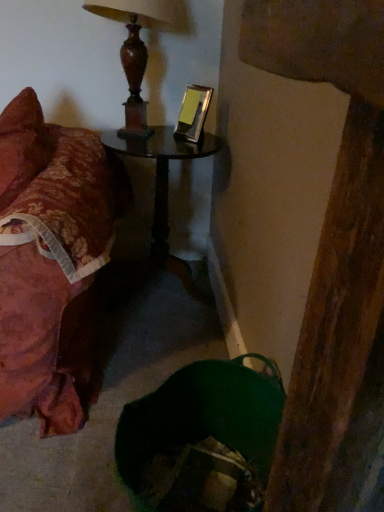
Question: From the image's perspective, would you say floral fabric bed at left is positioned over black glass table at center?

Choices:
 (A) yes
 (B) no

Answer: (B)

Question: Does floral fabric bed at left appear on the left side of black glass table at center?

Choices:
 (A) no
 (B) yes

Answer: (B)

Question: Considering the relative sizes of floral fabric bed at left and black glass table at center in the image provided, is floral fabric bed at left smaller than black glass table at center?

Choices:
 (A) no
 (B) yes

Answer: (A)

Question: From the image's perspective, is floral fabric bed at left beneath black glass table at center?

Choices:
 (A) yes
 (B) no

Answer: (A)

Question: Is floral fabric bed at left with black glass table at center?

Choices:
 (A) no
 (B) yes

Answer: (A)

Question: From the image's perspective, is black glass table at center above or below wooden lamp at upper center?

Choices:
 (A) below
 (B) above

Answer: (A)

Question: From a real-world perspective, is black glass table at center physically located above or below wooden lamp at upper center?

Choices:
 (A) above
 (B) below

Answer: (B)

Question: In terms of width, does black glass table at center look wider or thinner when compared to wooden lamp at upper center?

Choices:
 (A) thin
 (B) wide

Answer: (B)

Question: Considering their positions, is black glass table at center located in front of or behind wooden lamp at upper center?

Choices:
 (A) behind
 (B) front

Answer: (A)

Question: From a real-world perspective, relative to black glass table at center, is floral fabric bed at left vertically above or below?

Choices:
 (A) above
 (B) below

Answer: (A)

Question: From the image's perspective, is floral fabric bed at left located above or below black glass table at center?

Choices:
 (A) above
 (B) below

Answer: (B)

Question: Considering the relative positions of floral fabric bed at left and black glass table at center in the image provided, is floral fabric bed at left to the left or to the right of black glass table at center?

Choices:
 (A) right
 (B) left

Answer: (B)

Question: Is floral fabric bed at left inside or outside of black glass table at center?

Choices:
 (A) inside
 (B) outside

Answer: (B)

Question: Is floral fabric bed at left in front of or behind wooden lamp at upper center in the image?

Choices:
 (A) front
 (B) behind

Answer: (A)

Question: Based on their sizes in the image, would you say floral fabric bed at left is bigger or smaller than wooden lamp at upper center?

Choices:
 (A) big
 (B) small

Answer: (A)